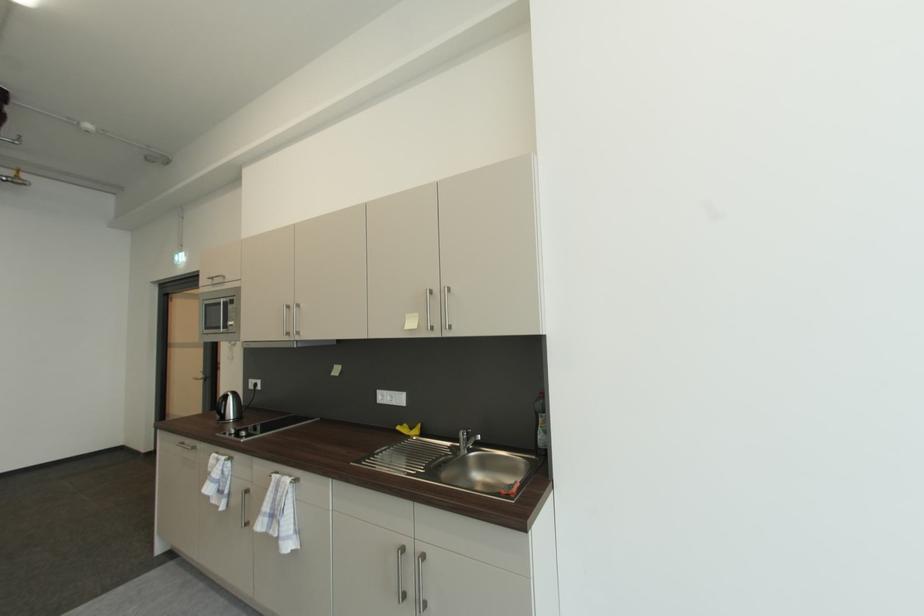
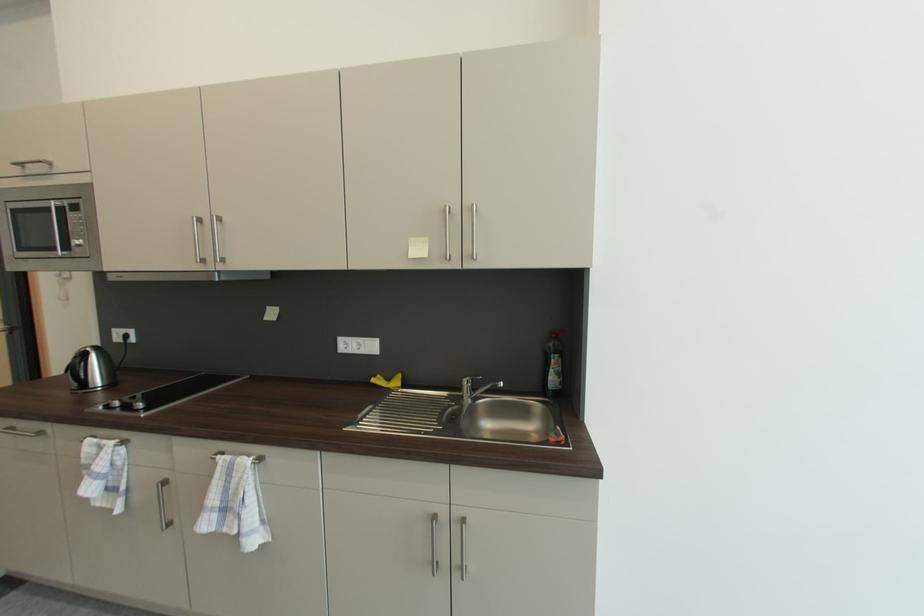
Question: The images are taken continuously from a first-person perspective. In which direction is your viewpoint rotating?

Choices:
 (A) Left
 (B) Right
 (C) Up
 (D) Down

Answer: (B)